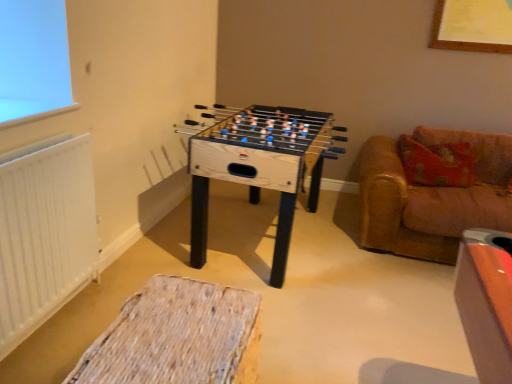
Question: Is point coord(394,145) closer or farther from the camera than point coord(280,114)?

Choices:
 (A) closer
 (B) farther

Answer: (B)

Question: Considering the positions of leather couch at right and natural wood foosball table at center in the image, is leather couch at right wider or thinner than natural wood foosball table at center?

Choices:
 (A) wide
 (B) thin

Answer: (A)

Question: Considering the real-world distances, which object is farthest from the woven fabric ottoman at lower center?

Choices:
 (A) white matte radiator at left
 (B) natural wood foosball table at center
 (C) leather couch at right

Answer: (C)

Question: Considering the real-world distances, which object is closest to the natural wood foosball table at center?

Choices:
 (A) woven fabric ottoman at lower center
 (B) white matte radiator at left
 (C) leather couch at right

Answer: (C)